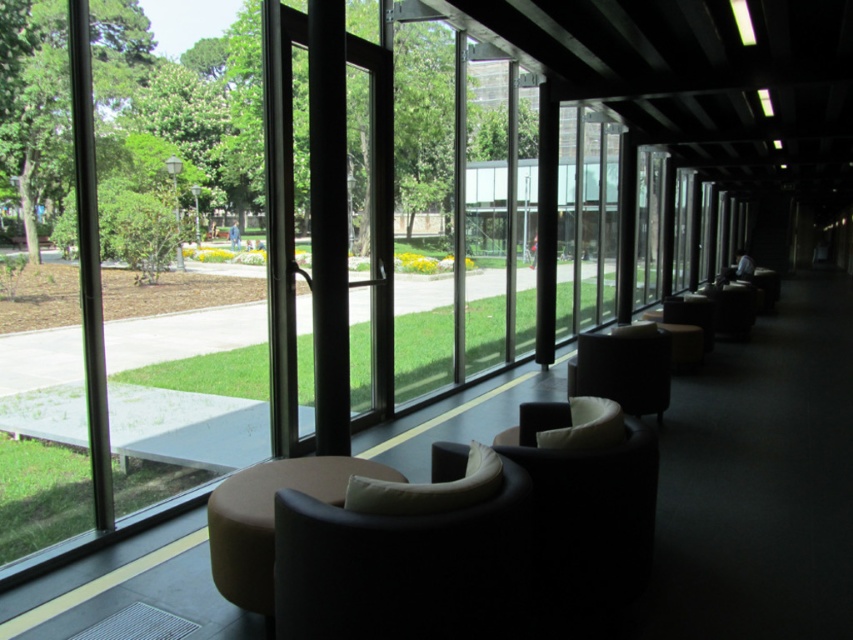
Consider the image. You are standing in the modern indoor space and looking through the large glass windows. There are two points marked in the scene. Which point is closer to you, point (386, 592) or point (619, 337)?

Point (386, 592) is closer to you than point (619, 337).

In the scene shown: You are a visitor entering the indoor space and want to sit on the lower furniture. Which one between the matte black armchair at center and the matte black chair at center should you choose?

The matte black armchair at center has a lesser height compared to the matte black chair at center, so you should choose the matte black armchair at center to sit on as it is lower.

You are a delivery person carrying a package that measures 3 meters in length. You need to pass through the space between the matte black armchair at center and the matte black chair at center. Can your package fit through the space between them without bending or folding it?

The distance between the matte black armchair at center and the matte black chair at center is 3.57 meters. Since your package is 3 meters long, it can fit through the space without needing to bend or fold it.